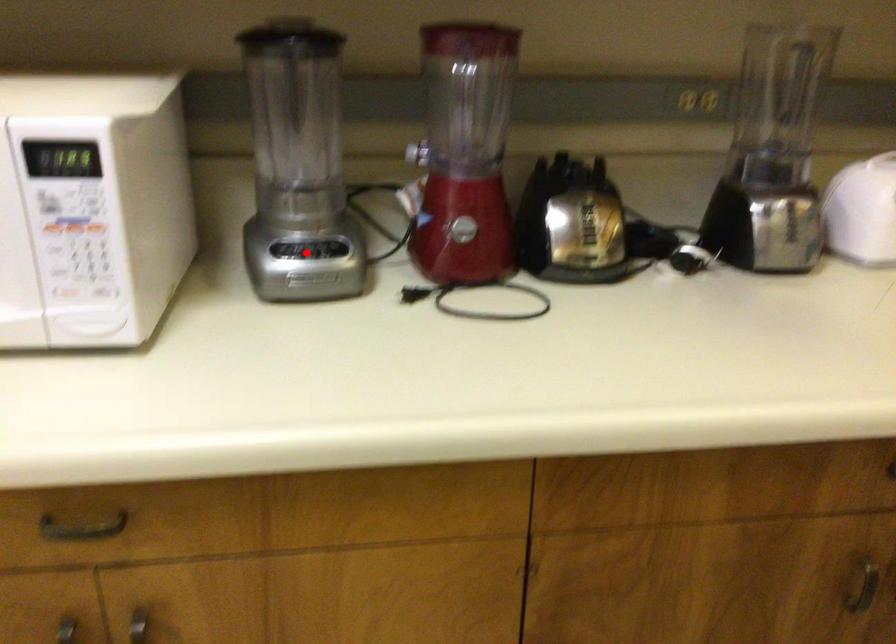
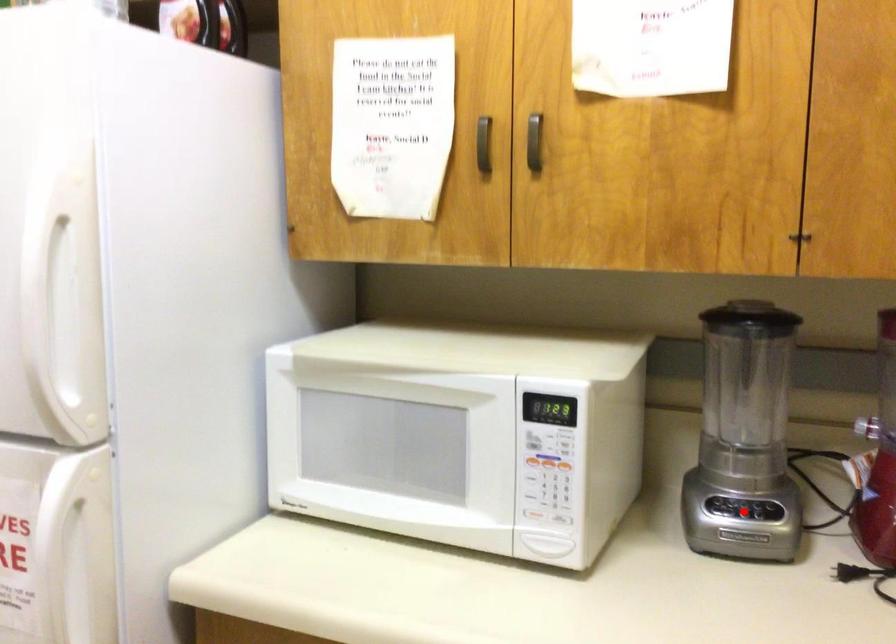
I am providing you with two images of the same scene from different viewpoints. A red point is marked on the first image and another point is marked on the second image. Do the highlighted points in image1 and image2 indicate the same real-world spot?

Yes